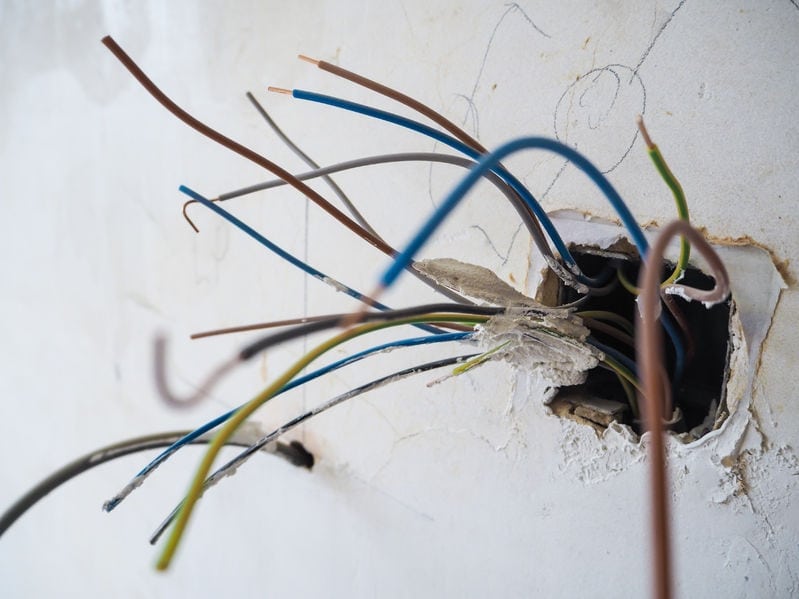
Locate an element on the screen. edges of circles drawn on wall is located at coordinates (630, 149), (559, 93), (631, 69), (430, 186), (476, 123), (447, 101).